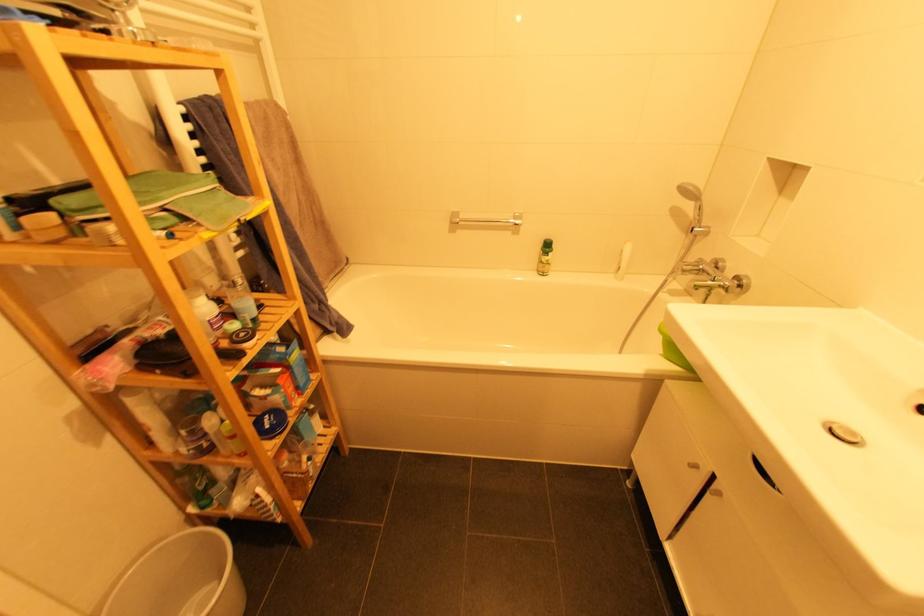
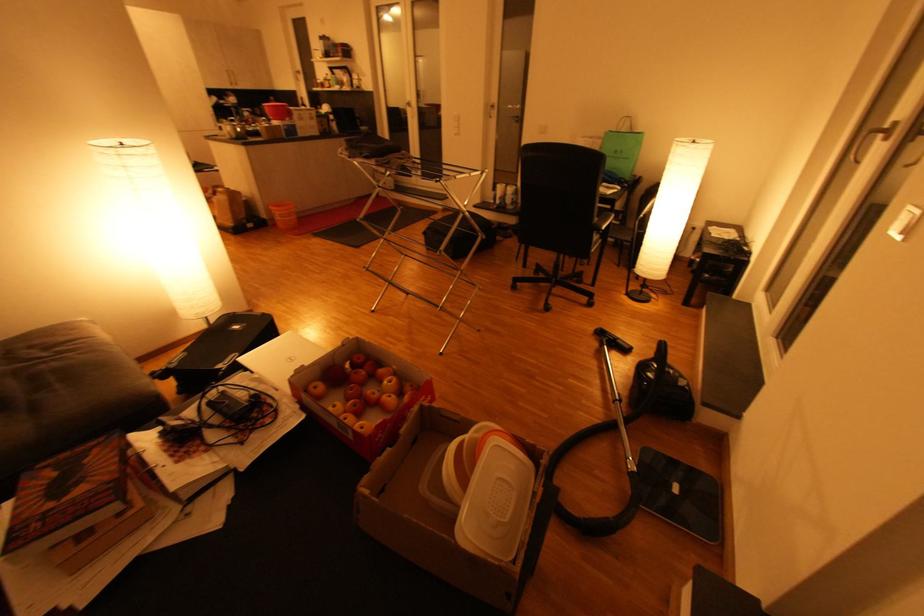
Question: I am providing you with two images of the same scene from different viewpoints. Please identify which objects are invisible in image2.

Choices:
 (A) cardboard box
 (B) blue round tin
 (C) door handle
 (D) clear glass vase

Answer: (B)